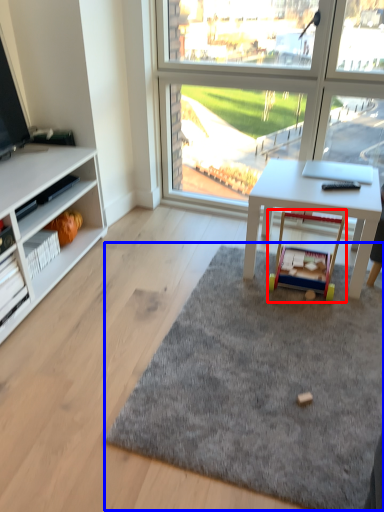
Question: Which point is further to the camera, toy (highlighted by a red box) or mat (highlighted by a blue box)?

Choices:
 (A) toy
 (B) mat

Answer: (A)